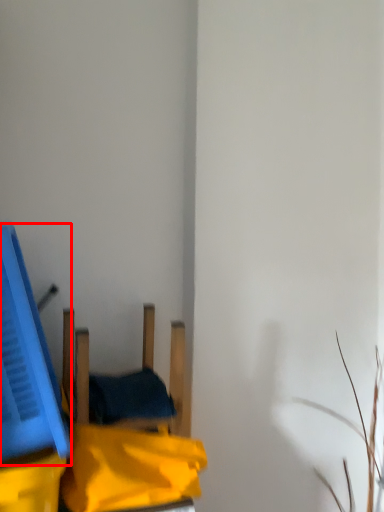
Question: Observing the image, what is the correct spatial positioning of wide (annotated by the red box) in reference to furniture?

Choices:
 (A) left
 (B) right

Answer: (A)